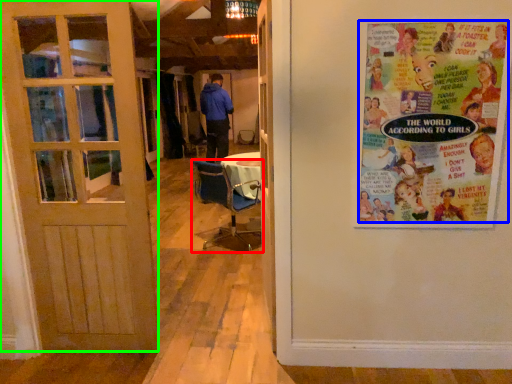
Question: Based on their relative distances, which object is nearer to chair (highlighted by a red box)? Choose from poster (highlighted by a blue box) and door (highlighted by a green box).

Choices:
 (A) poster
 (B) door

Answer: (B)